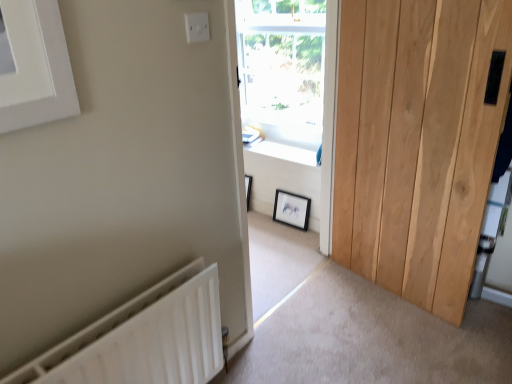
Question: Can we say white plastic electric outlet at upper center lies outside black matte picture frame at center?

Choices:
 (A) yes
 (B) no

Answer: (A)

Question: From a real-world perspective, is white plastic electric outlet at upper center beneath black matte picture frame at center?

Choices:
 (A) yes
 (B) no

Answer: (B)

Question: Is white plastic electric outlet at upper center to the left of black matte picture frame at center from the viewer's perspective?

Choices:
 (A) no
 (B) yes

Answer: (B)

Question: From the image's perspective, is white plastic electric outlet at upper center over black matte picture frame at center?

Choices:
 (A) no
 (B) yes

Answer: (B)

Question: Considering the relative sizes of white plastic electric outlet at upper center and black matte picture frame at center in the image provided, is white plastic electric outlet at upper center wider than black matte picture frame at center?

Choices:
 (A) no
 (B) yes

Answer: (A)

Question: Is black matte picture frame at center at the back of white plastic electric outlet at upper center?

Choices:
 (A) yes
 (B) no

Answer: (B)

Question: Is white wood window frame at center positioned with its back to black matte picture frame at center?

Choices:
 (A) no
 (B) yes

Answer: (A)

Question: Can you confirm if white wood window frame at center is positioned to the right of black matte picture frame at center?

Choices:
 (A) no
 (B) yes

Answer: (A)

Question: Does white wood window frame at center have a smaller size compared to black matte picture frame at center?

Choices:
 (A) yes
 (B) no

Answer: (B)

Question: From the image's perspective, is white wood window frame at center on top of black matte picture frame at center?

Choices:
 (A) no
 (B) yes

Answer: (B)

Question: Is white wood window frame at center behind black matte picture frame at center?

Choices:
 (A) yes
 (B) no

Answer: (B)

Question: From a real-world perspective, is white wood window frame at center on top of black matte picture frame at center?

Choices:
 (A) yes
 (B) no

Answer: (A)

Question: From the image's perspective, is transparent glass window at center on black matte picture frame at center?

Choices:
 (A) no
 (B) yes

Answer: (B)